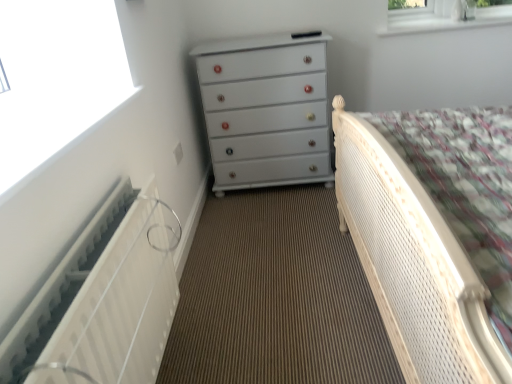
Question: From the image's perspective, would you say white textured radiator at left is shown under white cane bed at right?

Choices:
 (A) yes
 (B) no

Answer: (A)

Question: Does white textured radiator at left have a smaller size compared to white cane bed at right?

Choices:
 (A) yes
 (B) no

Answer: (A)

Question: Does white textured radiator at left come in front of white cane bed at right?

Choices:
 (A) yes
 (B) no

Answer: (B)

Question: Is white textured radiator at left at the right side of white cane bed at right?

Choices:
 (A) no
 (B) yes

Answer: (A)

Question: From the image's perspective, is white textured radiator at left on top of white cane bed at right?

Choices:
 (A) no
 (B) yes

Answer: (A)

Question: Would you say white textured radiator at left is a long distance from white cane bed at right?

Choices:
 (A) yes
 (B) no

Answer: (B)

Question: Does white cane bed at right touch white textured radiator at left?

Choices:
 (A) yes
 (B) no

Answer: (B)

Question: Is white cane bed at right positioned beyond the bounds of white textured radiator at left?

Choices:
 (A) no
 (B) yes

Answer: (B)

Question: From the image's perspective, is white cane bed at right below white textured radiator at left?

Choices:
 (A) no
 (B) yes

Answer: (A)

Question: Is white cane bed at right oriented away from white textured radiator at left?

Choices:
 (A) yes
 (B) no

Answer: (B)

Question: Is white cane bed at right wider than white textured radiator at left?

Choices:
 (A) no
 (B) yes

Answer: (B)

Question: From a real-world perspective, is white cane bed at right located beneath white textured radiator at left?

Choices:
 (A) no
 (B) yes

Answer: (A)

Question: Considering the relative sizes of white textured radiator at left and white glossy radiator at left in the image provided, is white textured radiator at left taller than white glossy radiator at left?

Choices:
 (A) yes
 (B) no

Answer: (A)